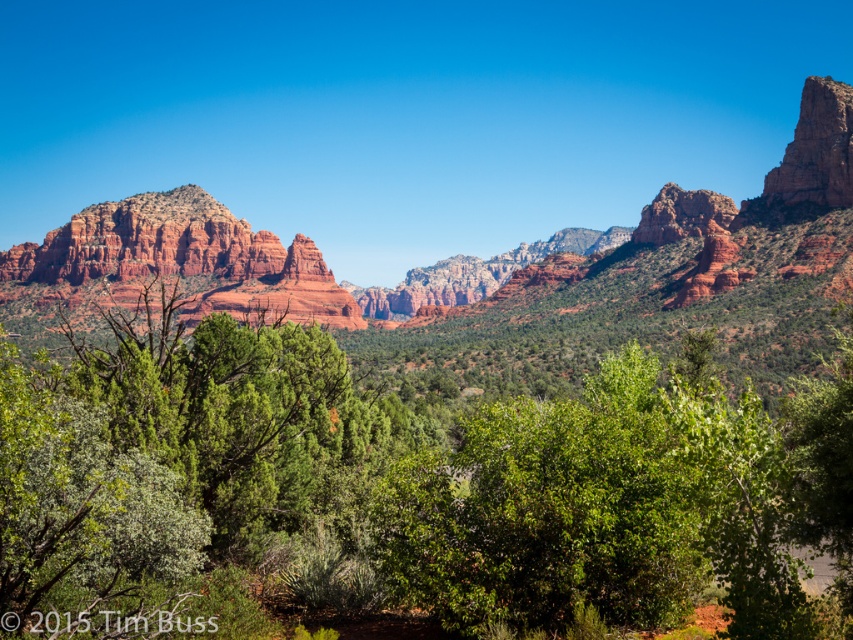
Question: Is green leafy tree at center wider than reddish-brown rock formation at center?

Choices:
 (A) yes
 (B) no

Answer: (B)

Question: Is green leafy tree at center thinner than reddish-brown rock formation at center?

Choices:
 (A) no
 (B) yes

Answer: (B)

Question: Which object is closer to the camera taking this photo?

Choices:
 (A) green leafy tree at center
 (B) reddish-brown rock formation at center

Answer: (A)

Question: Can you confirm if green leafy tree at center is smaller than reddish-brown rock formation at center?

Choices:
 (A) yes
 (B) no

Answer: (A)

Question: Which point appears closest to the camera in this image?

Choices:
 (A) (80, 554)
 (B) (845, 150)

Answer: (A)